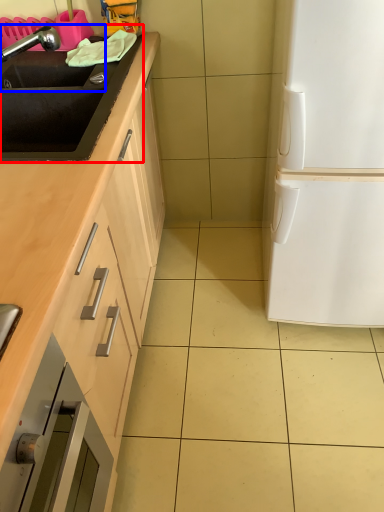
Question: Which object appears farthest to the camera in this image, sink (highlighted by a red box) or sink (highlighted by a blue box)?

Choices:
 (A) sink
 (B) sink

Answer: (B)